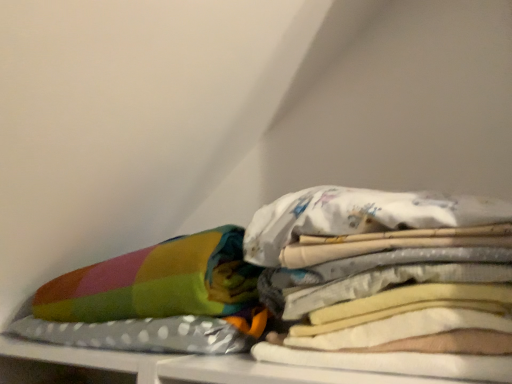
Question: Relative to white fabric at center, is multicolored fabric pillow at left in front or behind?

Choices:
 (A) behind
 (B) front

Answer: (A)

Question: Which is correct: multicolored fabric pillow at left is inside white fabric at center, or outside of it?

Choices:
 (A) inside
 (B) outside

Answer: (B)

Question: From a real-world perspective, is multicolored fabric pillow at left above or below white fabric at center?

Choices:
 (A) below
 (B) above

Answer: (A)

Question: In the image, is white fabric at center positioned in front of or behind multicolored fabric pillow at left?

Choices:
 (A) front
 (B) behind

Answer: (A)

Question: Considering the positions of point (294, 195) and point (206, 240), is point (294, 195) closer or farther from the camera than point (206, 240)?

Choices:
 (A) farther
 (B) closer

Answer: (B)

Question: Is white fabric at center wider or thinner than multicolored fabric pillow at left?

Choices:
 (A) thin
 (B) wide

Answer: (A)

Question: From their relative heights in the image, would you say white fabric at center is taller or shorter than multicolored fabric pillow at left?

Choices:
 (A) short
 (B) tall

Answer: (A)